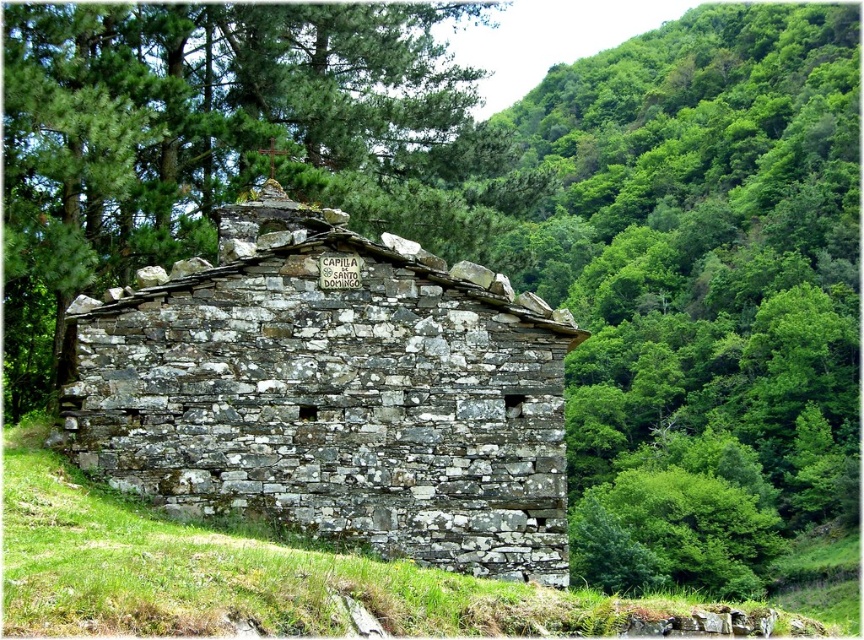
Looking at this image, you are standing in front of the CAPILLA DE SANTO DOMINGO and looking at the chapel. There are two points marked on the chapel wall. The first point is at coordinate point (164, 285) and the second point is at coordinate point (753, 628). Which point is closer to you?

Point (164, 285) is closer to you because it is further to the camera than point (753, 628).